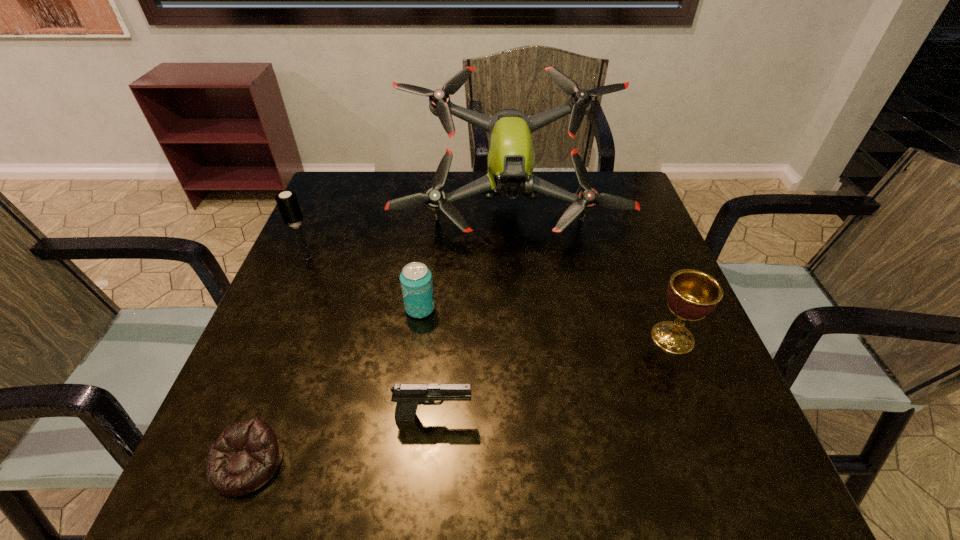
You are a GUI agent. You are given a task and a screenshot of the screen. Output one action in this format:
    pyautogui.click(x=<x>, y=<y>)
    Task: Click on the free area in between the second shortest object and the nearest object
    
    Given the screenshot: What is the action you would take?
    pyautogui.click(x=341, y=439)

Find the location of a particular element. Image resolution: width=960 pixels, height=540 pixels. vacant space that is in between the beer can and the nearest object is located at coordinates (334, 386).

Find the location of a particular element. unoccupied position between the nearest object and the pistol is located at coordinates (341, 439).

Image resolution: width=960 pixels, height=540 pixels. What are the coordinates of `free space between the beer can and the fifth tallest object` in the screenshot? It's located at (427, 362).

This screenshot has height=540, width=960. In order to click on free spot between the drone and the fifth shortest object in this screenshot , I will do `click(407, 233)`.

This screenshot has width=960, height=540. Identify the location of free space between the fourth nearest object and the drone. (464, 259).

The height and width of the screenshot is (540, 960). Find the location of `vacant space that is in between the fifth tallest object and the third nearest object`. vacant space that is in between the fifth tallest object and the third nearest object is located at coordinates (553, 377).

Identify the location of free space between the second tallest object and the pistol. (371, 336).

Locate an element on the screen. Image resolution: width=960 pixels, height=540 pixels. vacant area between the drone and the third farthest object is located at coordinates (464, 259).

I want to click on free space between the drone and the second shortest object, so click(x=471, y=313).